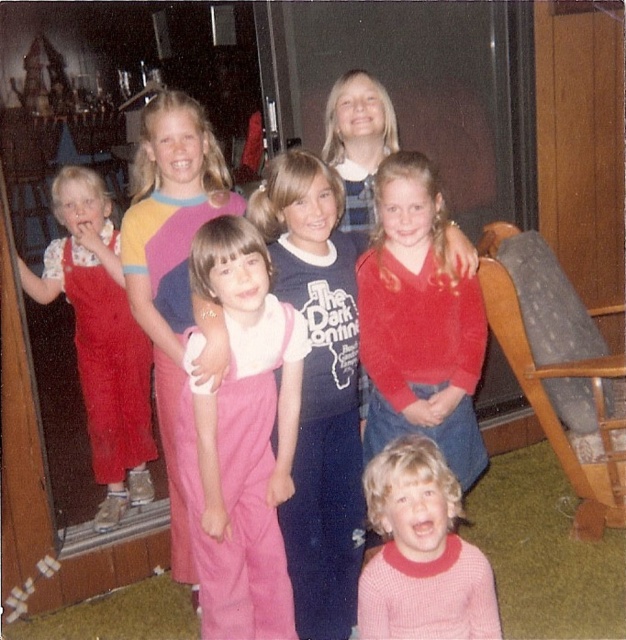
Is point (470, 314) positioned before point (183, 266)?

That is False.

Who is taller, matte red sweater at center or pink fabric pants at center?

pink fabric pants at center is taller.

Is point (398, 324) closer to camera compared to point (190, 576)?

Yes, it is in front of point (190, 576).

The image size is (626, 640). In order to click on matte red sweater at center in this screenshot , I will do `click(418, 323)`.

Who is more forward, (393, 380) or (480, 257)?

Positioned in front is point (393, 380).

Is point (475, 422) more distant than point (588, 326)?

No.

Find the location of a particular element. matte red sweater at center is located at coordinates (418, 323).

Does gray fabric rocking chair at lower right have a greater width compared to pink knitted sweater at lower center?

Indeed, gray fabric rocking chair at lower right has a greater width compared to pink knitted sweater at lower center.

Can you confirm if gray fabric rocking chair at lower right is positioned below pink knitted sweater at lower center?

No.

At what (x,y) coordinates should I click in order to perform the action: click on gray fabric rocking chair at lower right. Please return your answer as a coordinate pair (x, y). This screenshot has height=640, width=626. Looking at the image, I should click on (557, 369).

Find the location of a particular element. gray fabric rocking chair at lower right is located at coordinates (557, 369).